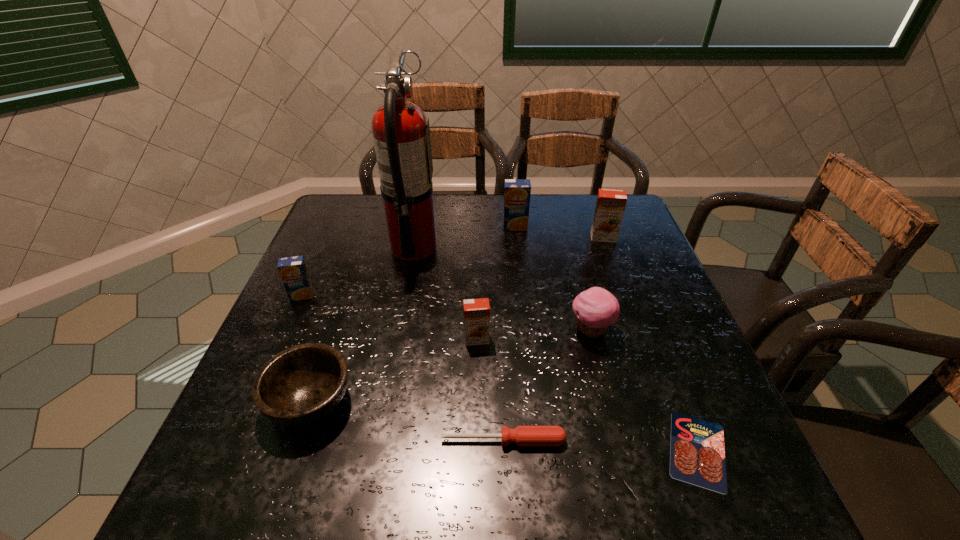
This screenshot has height=540, width=960. Find the location of `vacant region located on the back of the seventh object from left to right`. vacant region located on the back of the seventh object from left to right is located at coordinates (563, 220).

Identify the location of vacant space located on the right of the left blue orange_juice. (436, 295).

The image size is (960, 540). I want to click on blank space located on the back of the smaller orange orange juice, so click(x=477, y=254).

The image size is (960, 540). What are the coordinates of `vacant area situated on the back of the brown bowl` in the screenshot? It's located at (353, 274).

Image resolution: width=960 pixels, height=540 pixels. I want to click on free spot located 0.240m on the right of the screwdriver, so click(698, 441).

The image size is (960, 540). What are the coordinates of `free space located on the left of the shortest object` in the screenshot? It's located at (606, 450).

Identify the location of fire extinguisher located in the far edge section of the desktop. (401, 133).

You are a GUI agent. You are given a task and a screenshot of the screen. Output one action in this format:
    pyautogui.click(x=<x>, y=<y>)
    Task: Click on the object located at the near edge
    
    Given the screenshot: What is the action you would take?
    pyautogui.click(x=697, y=456)

The image size is (960, 540). Identify the location of orange_juice present at the left edge. (293, 271).

Identify the location of bowl at the left edge. [x=300, y=385].